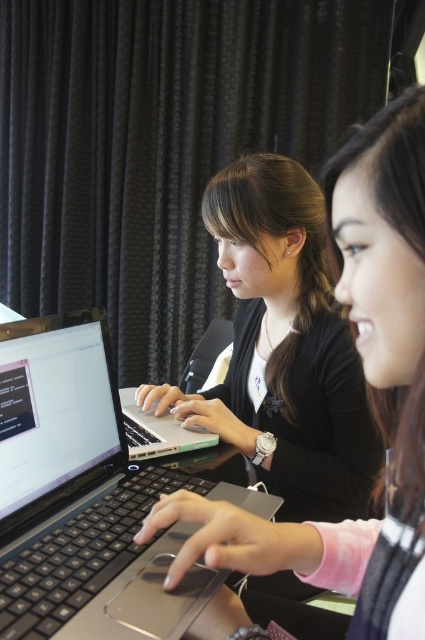
Between point (399, 188) and point (8, 332), which one is positioned in front?

Point (399, 188) is more forward.

Is matte black laptop at left in front of silver metallic laptop at left?

Yes.

Is point (153, 524) positioned behind point (65, 314)?

That is False.

Find the location of a particular element. matte black laptop at left is located at coordinates (368, 394).

Which of these two, silver metallic laptop at center or silver metallic laptop at left, stands taller?

silver metallic laptop at center

Does silver metallic laptop at center appear on the right side of silver metallic laptop at left?

Correct, you'll find silver metallic laptop at center to the right of silver metallic laptop at left.

Does point (203, 490) come farther from viewer compared to point (166, 452)?

That is False.

I want to click on silver metallic laptop at center, so click(x=85, y=497).

Can you confirm if silver metallic laptop at center is positioned to the right of matte black laptop at left?

No, silver metallic laptop at center is not to the right of matte black laptop at left.

Does point (39, 628) lie in front of point (391, 483)?

Yes.

Who is more distant from viewer, (70, 408) or (345, 592)?

The point (70, 408) is behind.

In order to click on silver metallic laptop at center in this screenshot , I will do `click(85, 497)`.